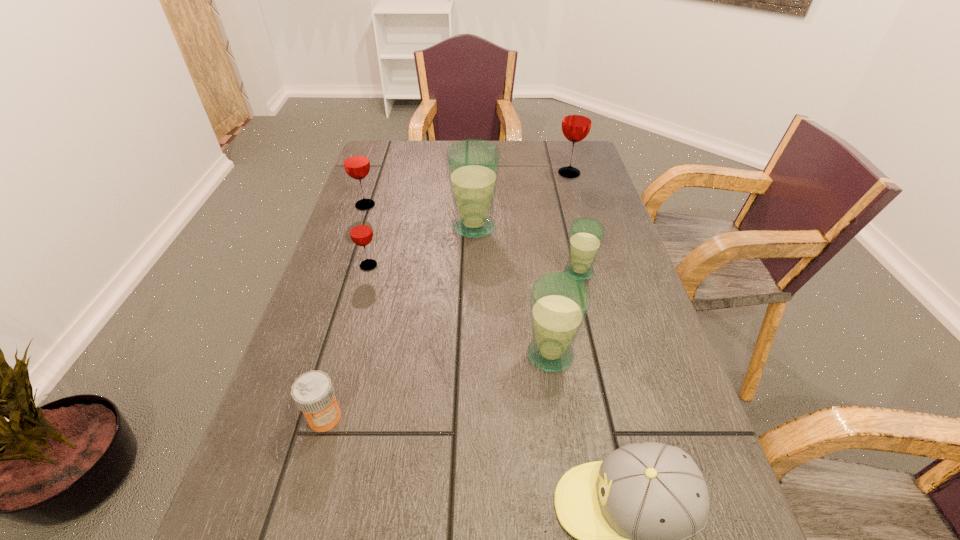
The height and width of the screenshot is (540, 960). In order to click on the farthest object in this screenshot , I will do `click(576, 124)`.

Find the location of a particular element. the farthest red glass is located at coordinates (576, 124).

The width and height of the screenshot is (960, 540). In order to click on the fourth nearest glass in this screenshot , I will do coord(473,165).

Identify the location of the third glass from left to right. This screenshot has height=540, width=960. (473, 165).

Locate an element on the screen. the second biggest red glass is located at coordinates coord(356,162).

Identify the location of the second nearest red glass. This screenshot has height=540, width=960. (356, 162).

Image resolution: width=960 pixels, height=540 pixels. I want to click on the third nearest object, so click(x=559, y=301).

The image size is (960, 540). I want to click on the fourth glass from left to right, so click(559, 301).

You are a GUI agent. You are given a task and a screenshot of the screen. Output one action in this format:
    pyautogui.click(x=<x>, y=<y>)
    Task: Click on the smallest red glass
    
    Given the screenshot: What is the action you would take?
    pyautogui.click(x=360, y=230)

Identify the location of the rightmost blue glass. (586, 234).